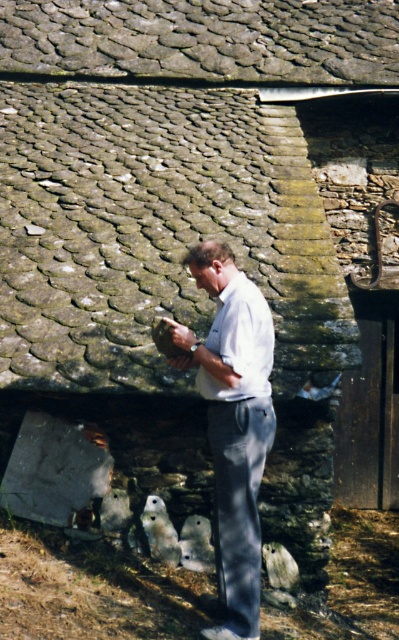
Question: Which point is farther to the camera?

Choices:
 (A) white matte owl at lower center
 (B) white cotton shirt at center

Answer: (A)

Question: Which of the following is the closest to the observer?

Choices:
 (A) white matte owl at lower center
 (B) white cotton shirt at center

Answer: (B)

Question: Is white cotton shirt at center closer to camera compared to white matte owl at lower center?

Choices:
 (A) no
 (B) yes

Answer: (B)

Question: Is white cotton shirt at center above white matte owl at lower center?

Choices:
 (A) yes
 (B) no

Answer: (A)

Question: Does white cotton shirt at center lie in front of white matte owl at lower center?

Choices:
 (A) yes
 (B) no

Answer: (A)

Question: Among these points, which one is nearest to the camera?

Choices:
 (A) [152, 525]
 (B) [237, 416]

Answer: (B)